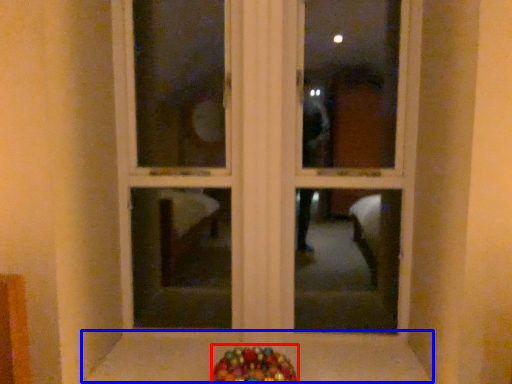
Question: Among these objects, which one is nearest to the camera, candy (highlighted by a red box) or window sill (highlighted by a blue box)?

Choices:
 (A) candy
 (B) window sill

Answer: (A)